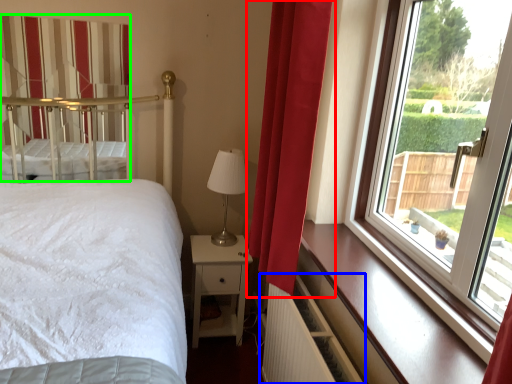
Question: Based on their relative distances, which object is nearer to curtain (highlighted by a red box)? Choose from radiator (highlighted by a blue box) and curtain (highlighted by a green box).

Choices:
 (A) radiator
 (B) curtain

Answer: (A)